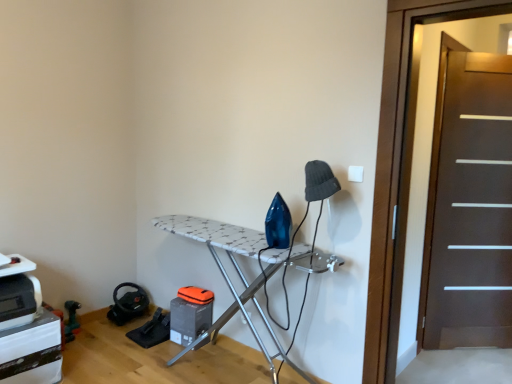
Question: Is dark brown wooden screen door at right, the 2th screen door when ordered from back to front, aimed at dark brown wood screen door at right, which is counted as the second screen door, starting from the front?

Choices:
 (A) no
 (B) yes

Answer: (B)

Question: Is dark brown wooden screen door at right, the 2th screen door when ordered from back to front, to the right of dark brown wood screen door at right, the second screen door from the left, from the viewer's perspective?

Choices:
 (A) no
 (B) yes

Answer: (A)

Question: From the image's perspective, is dark brown wooden screen door at right, arranged as the 1th screen door when viewed from the left, over dark brown wood screen door at right, which is counted as the second screen door, starting from the front?

Choices:
 (A) no
 (B) yes

Answer: (B)

Question: Can you confirm if dark brown wooden screen door at right, the 2th screen door when ordered from back to front, is thinner than dark brown wood screen door at right, positioned as the first screen door in right-to-left order?

Choices:
 (A) yes
 (B) no

Answer: (B)

Question: From a real-world perspective, does dark brown wooden screen door at right, arranged as the 1th screen door when viewed from the left, stand above dark brown wood screen door at right, the second screen door from the left?

Choices:
 (A) no
 (B) yes

Answer: (B)

Question: Is dark brown wooden screen door at right, the 2th screen door when ordered from back to front, placed right next to dark brown wood screen door at right, the second screen door from the left?

Choices:
 (A) yes
 (B) no

Answer: (B)

Question: Is white textured ironing board at center oriented away from dark brown wooden screen door at right, arranged as the second screen door when viewed from the right?

Choices:
 (A) yes
 (B) no

Answer: (B)

Question: Can you confirm if white textured ironing board at center is smaller than dark brown wooden screen door at right, the 2th screen door when ordered from back to front?

Choices:
 (A) no
 (B) yes

Answer: (A)

Question: Does white textured ironing board at center lie behind dark brown wooden screen door at right, arranged as the second screen door when viewed from the right?

Choices:
 (A) yes
 (B) no

Answer: (A)

Question: Does white textured ironing board at center have a larger size compared to dark brown wooden screen door at right, arranged as the 1th screen door when viewed from the left?

Choices:
 (A) yes
 (B) no

Answer: (A)

Question: From the image's perspective, is white textured ironing board at center below dark brown wooden screen door at right, the 2th screen door when ordered from back to front?

Choices:
 (A) no
 (B) yes

Answer: (B)

Question: Is there a large distance between white textured ironing board at center and dark brown wooden screen door at right, the 2th screen door when ordered from back to front?

Choices:
 (A) yes
 (B) no

Answer: (B)

Question: Does white textured ironing board at center lie behind dark brown wood screen door at right, which is counted as the second screen door, starting from the front?

Choices:
 (A) yes
 (B) no

Answer: (B)